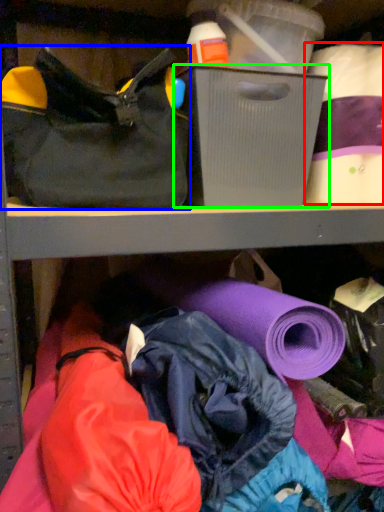
Question: Estimate the real-world distances between objects in this image. Which object is closer to toilet paper (highlighted by a red box), handbag (highlighted by a blue box) or storage box (highlighted by a green box)?

Choices:
 (A) handbag
 (B) storage box

Answer: (B)